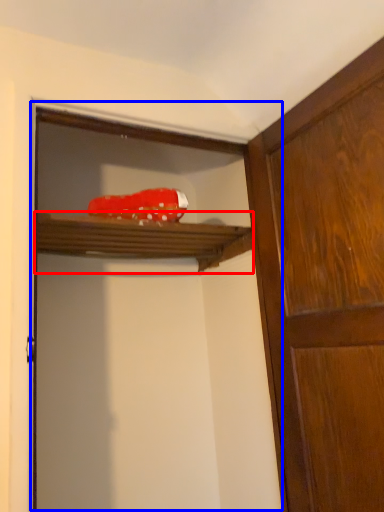
Question: Which object appears farthest to the camera in this image, shelf (highlighted by a red box) or screen door (highlighted by a blue box)?

Choices:
 (A) shelf
 (B) screen door

Answer: (A)